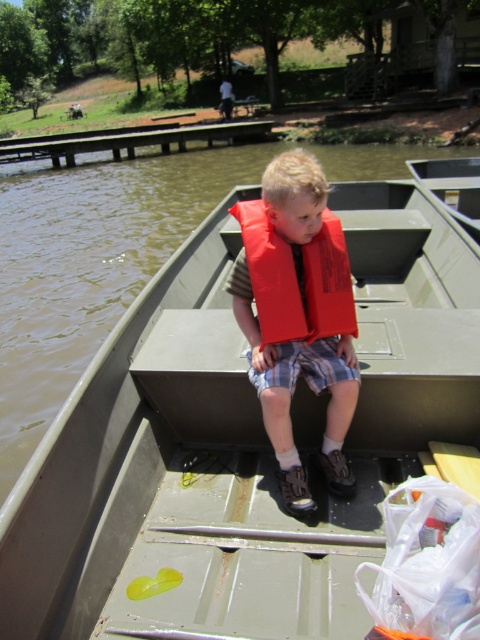
From the picture: Is metallic gray boat at center thinner than matte orange life vest at center?

No, metallic gray boat at center is not thinner than matte orange life vest at center.

Is point (382, 483) in front of point (250, 240)?

No, (382, 483) is further to viewer.

Image resolution: width=480 pixels, height=640 pixels. What are the coordinates of `metallic gray boat at center` in the screenshot? It's located at (239, 445).

In the scene shown: Can you confirm if metallic gray boat at center is positioned to the right of red matte life jacket at center?

Indeed, metallic gray boat at center is positioned on the right side of red matte life jacket at center.

Can you confirm if metallic gray boat at center is positioned below red matte life jacket at center?

Yes, metallic gray boat at center is below red matte life jacket at center.

Does point (173, 534) lie behind point (316, 310)?

Yes, it is.

You are a GUI agent. You are given a task and a screenshot of the screen. Output one action in this format:
    pyautogui.click(x=<x>, y=<y>)
    Task: Click on the metallic gray boat at center
    
    Given the screenshot: What is the action you would take?
    pyautogui.click(x=239, y=445)

Which of these two, matte orange life vest at center or red matte life jacket at center, stands taller?

With more height is matte orange life vest at center.

Is matte orange life vest at center bigger than red matte life jacket at center?

Correct, matte orange life vest at center is larger in size than red matte life jacket at center.

Is point (278, 376) closer to viewer compared to point (339, 292)?

Yes, point (278, 376) is closer to viewer.

Locate an element on the screen. The image size is (480, 640). matte orange life vest at center is located at coordinates (294, 317).